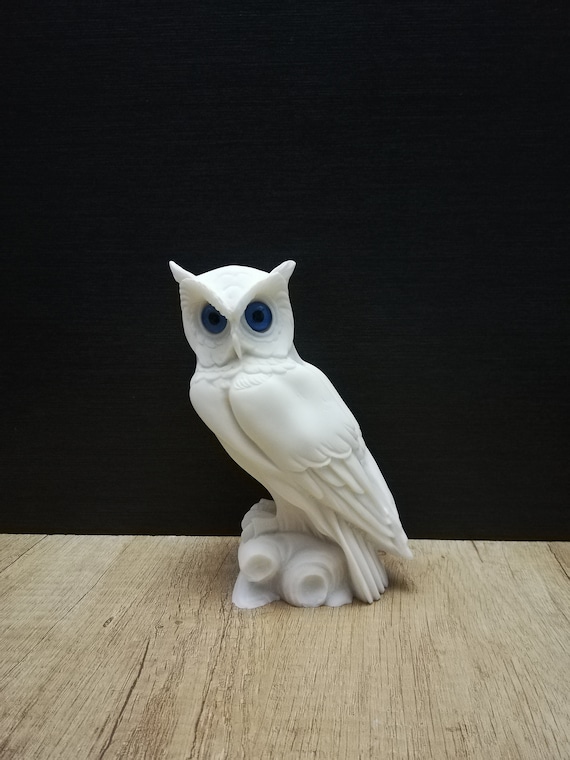
Where is `wooden surface`? wooden surface is located at coordinates (312, 660).